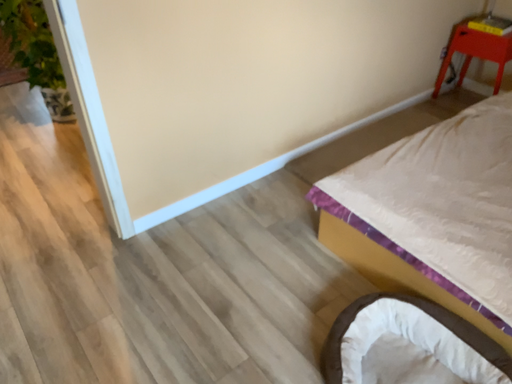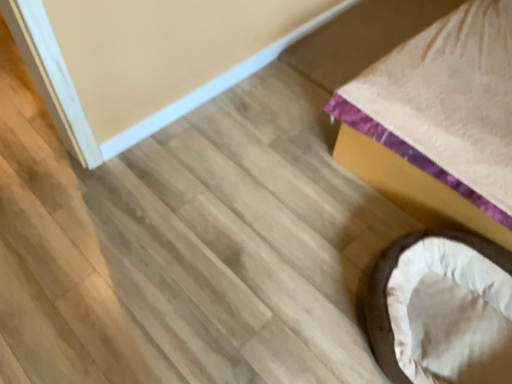
Question: How did the camera likely rotate when shooting the video?

Choices:
 (A) rotated right
 (B) rotated left

Answer: (A)